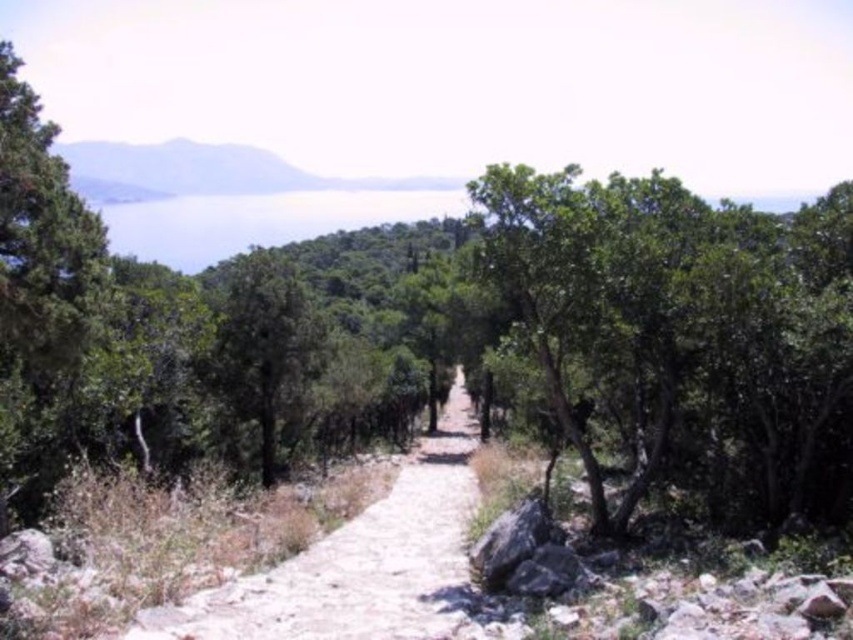
Is green leafy tree at center wider than dusty stone path at center?

Yes, green leafy tree at center is wider than dusty stone path at center.

Is green leafy tree at center positioned in front of dusty stone path at center?

That is False.

Does point (753, 401) lie behind point (332, 557)?

That is False.

Image resolution: width=853 pixels, height=640 pixels. I want to click on green leafy tree at center, so click(683, 333).